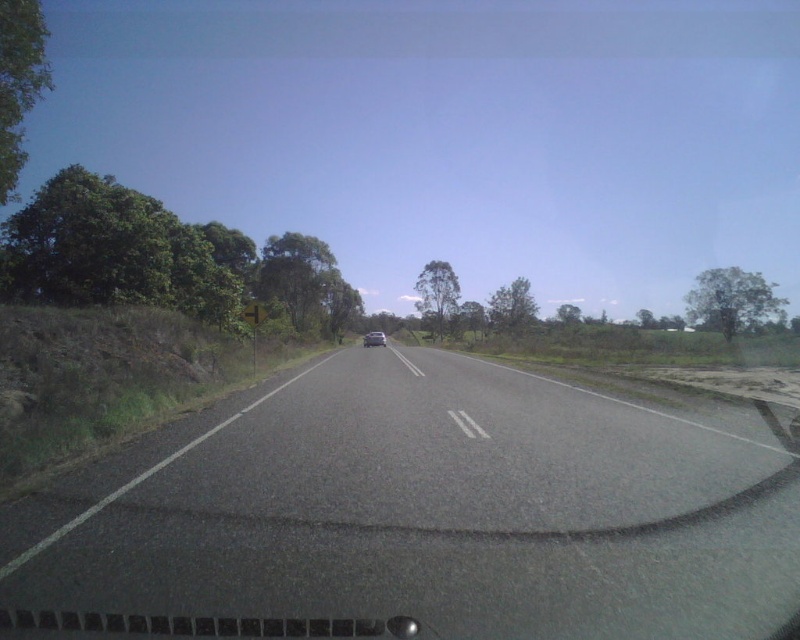
Question: Is asphalt road at center thinner than satin silver sedan at center?

Choices:
 (A) yes
 (B) no

Answer: (B)

Question: Which point appears closest to the camera in this image?

Choices:
 (A) (408, 483)
 (B) (380, 340)

Answer: (A)

Question: Is asphalt road at center to the left of satin silver sedan at center from the viewer's perspective?

Choices:
 (A) yes
 (B) no

Answer: (B)

Question: Is asphalt road at center below satin silver sedan at center?

Choices:
 (A) no
 (B) yes

Answer: (B)